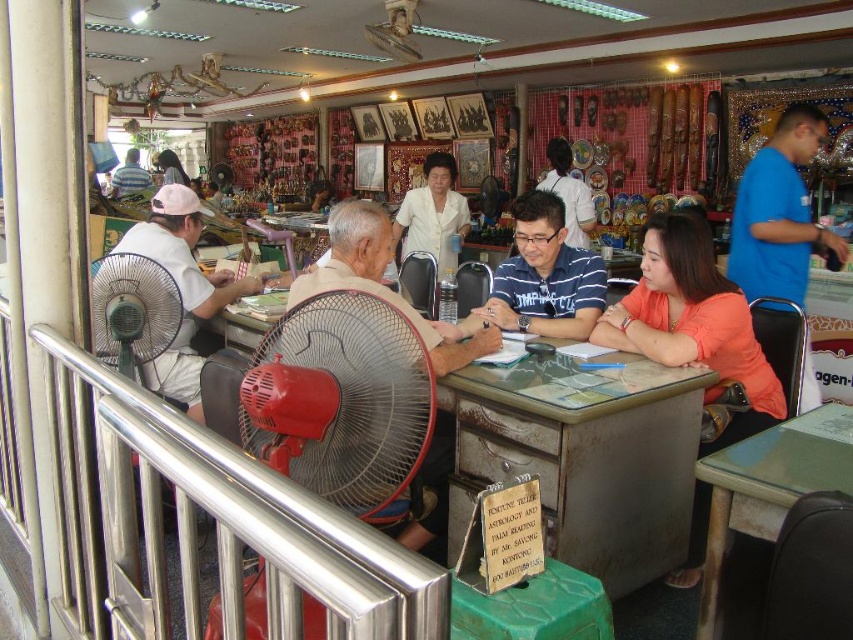
You are a customer in the shop and want to adjust the red plastic fan at center to get more airflow. However, you notice the orange matte shirt at center is in the way. Can you move the fan upwards to avoid the shirt?

The red plastic fan at center is positioned under orange matte shirt at center, so moving it upwards would bring it closer to the shirt. To avoid obstruction, you might need to move it sideways instead.

You are a delivery person who needs to place a package on the metallic gray desk at center. The package is 6 feet long. Can you fit it on the desk without exceeding its length?

The metallic gray desk at center and camera are 6.44 feet apart. The package is 6 feet long, so it can be placed on the desk as it is shorter than the distance between the desk and the camera. However, this measurement might not directly indicate the desk length. Please confirm the desk dimensions before placing the package.